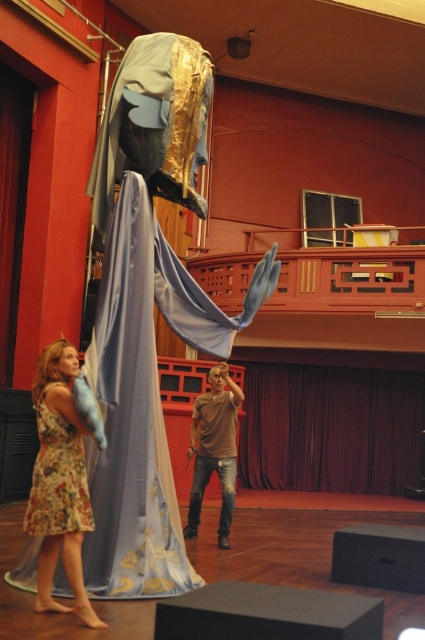
Is point (411, 404) closer to viewer compared to point (76, 461)?

That is False.

Is velvet dark red curtain at center closer to the viewer compared to floral fabric dress at lower left?

No, it is not.

Find the location of `velvet dark red curtain at center`. velvet dark red curtain at center is located at coordinates (331, 428).

Which of these two, velvet dark red curtain at center or brown cotton shirt at center, stands shorter?

brown cotton shirt at center

From the picture: Is the position of velvet dark red curtain at center more distant than that of brown cotton shirt at center?

Yes, it is behind brown cotton shirt at center.

Which is behind, point (407, 451) or point (217, 403)?

Point (407, 451)

Where is `velvet dark red curtain at center`? velvet dark red curtain at center is located at coordinates (331, 428).

Can you confirm if floral dress at lower left is positioned below floral fabric dress at lower left?

Indeed, floral dress at lower left is positioned under floral fabric dress at lower left.

Is floral dress at lower left thinner than floral fabric dress at lower left?

No.

Describe the element at coordinates (59, 483) in the screenshot. I see `floral dress at lower left` at that location.

Where is `floral dress at lower left`? The height and width of the screenshot is (640, 425). floral dress at lower left is located at coordinates (59, 483).